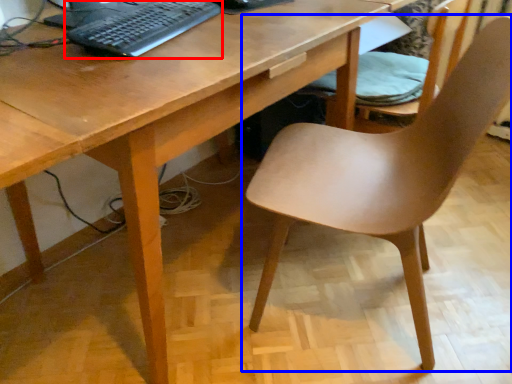
Question: Which object appears farthest to the camera in this image, computer keyboard (highlighted by a red box) or chair (highlighted by a blue box)?

Choices:
 (A) computer keyboard
 (B) chair

Answer: (A)